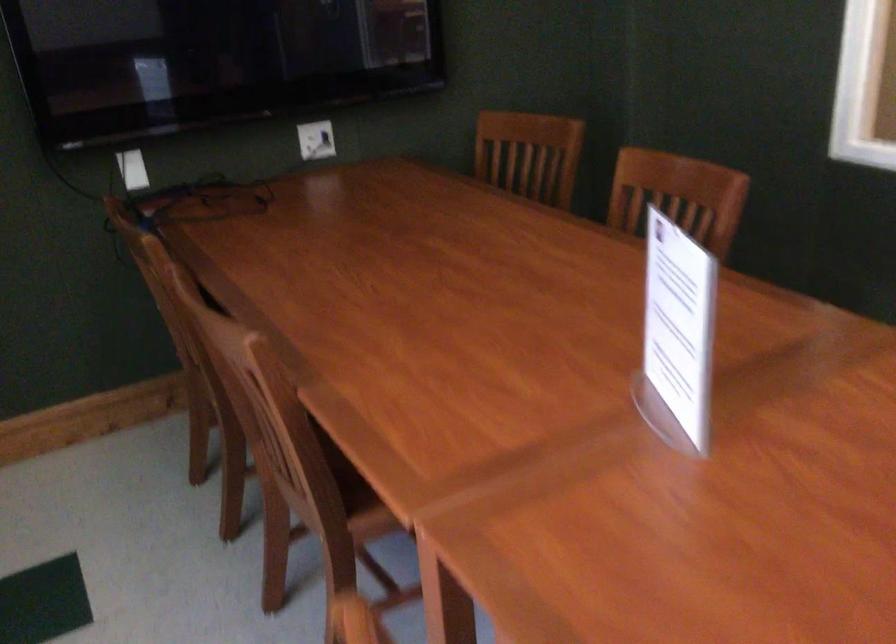
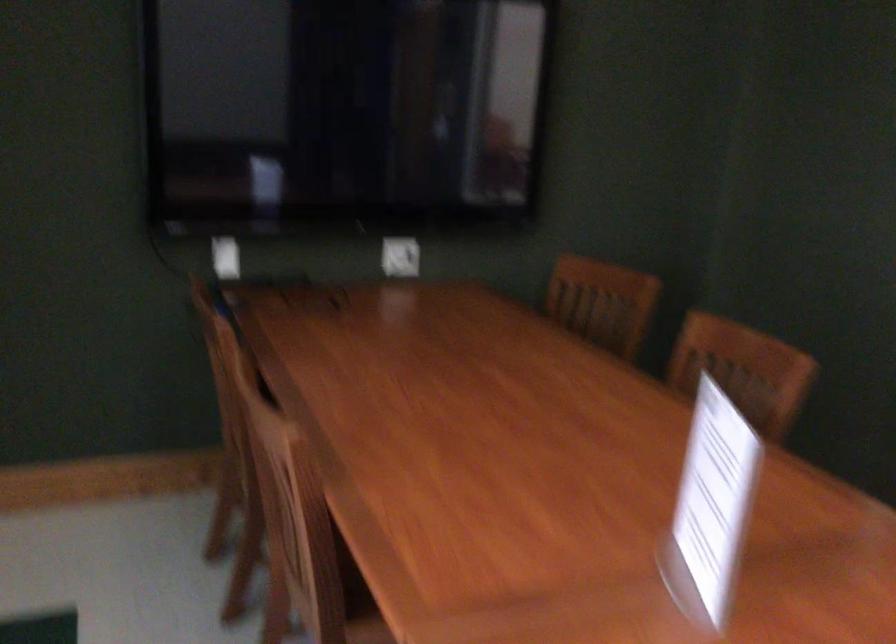
Question: Based on the continuous images, in which direction is the camera rotating? Reply with the corresponding letter.

Choices:
 (A) Left
 (B) Right
 (C) Up
 (D) Down

Answer: (C)